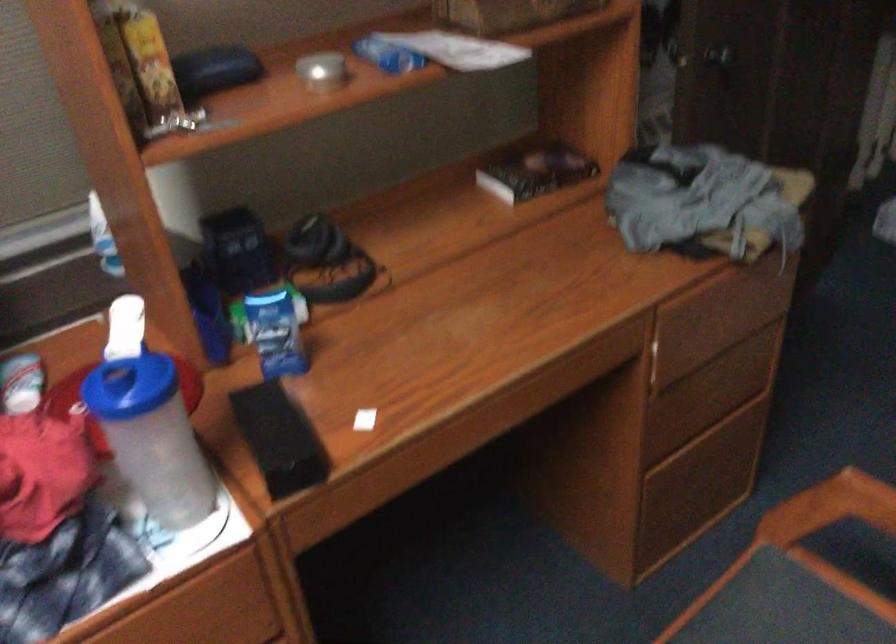
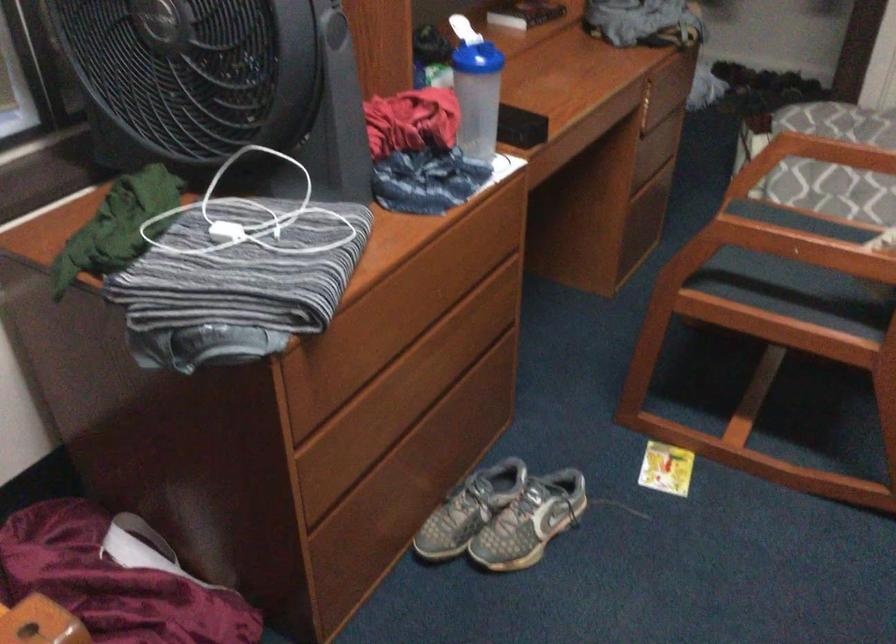
Find the pixel in the second image that matches [673,440] in the first image.

(643, 169)